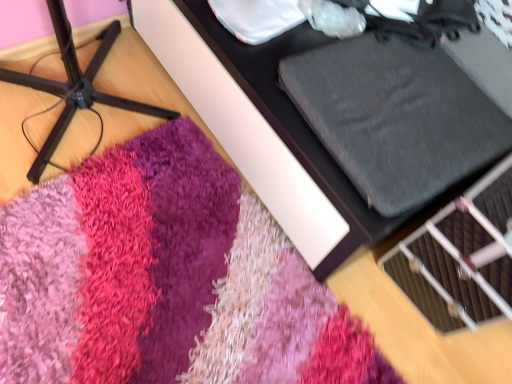
At what (x,y) coordinates should I click in order to perform the action: click on vacant point above shaggy pink rug at lower center (from a real-world perspective). Please return your answer as a coordinate pair (x, y). This screenshot has width=512, height=384. Looking at the image, I should click on (183, 225).